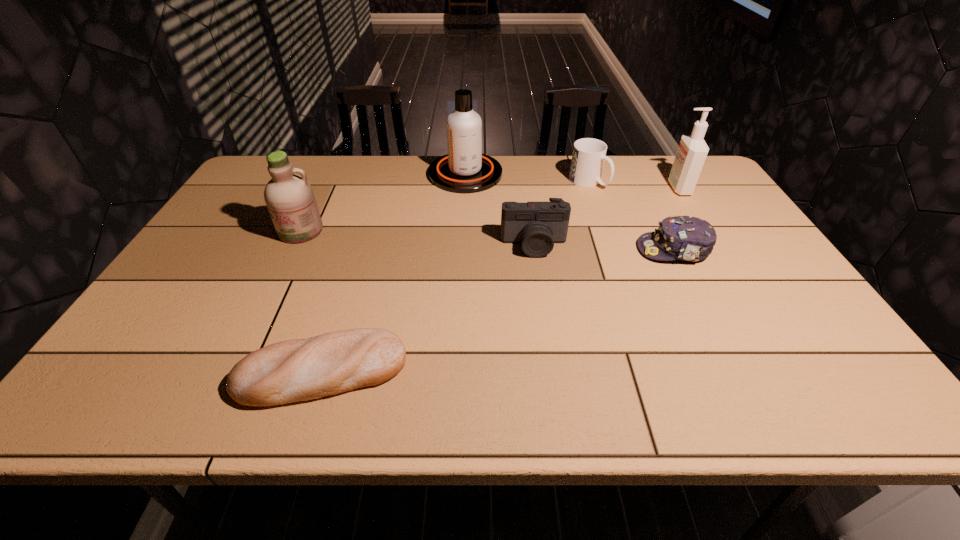
Locate an element on the screen. free space between the rightmost cleansing agent and the third object from right to left is located at coordinates (x=634, y=185).

Identify the location of empty space that is in between the second cleansing agent from left to right and the bread. The image size is (960, 540). (394, 273).

Where is `free spot between the leftmost cleansing agent and the nearest object`? This screenshot has width=960, height=540. free spot between the leftmost cleansing agent and the nearest object is located at coordinates (311, 301).

Where is `free space between the rightmost cleansing agent and the camera`? Image resolution: width=960 pixels, height=540 pixels. free space between the rightmost cleansing agent and the camera is located at coordinates (606, 217).

The width and height of the screenshot is (960, 540). I want to click on vacant point located between the nearest object and the leftmost cleansing agent, so click(x=311, y=301).

At what (x,y) coordinates should I click in order to perform the action: click on vacant area that lies between the rightmost cleansing agent and the camera. Please return your answer as a coordinate pair (x, y). Looking at the image, I should click on (606, 217).

Find the location of a particular element. Image resolution: width=960 pixels, height=540 pixels. vacant space in between the nearest object and the second cleansing agent from left to right is located at coordinates (394, 273).

Select which object is the fourth closest to the mug. Please provide its 2D coordinates. Your answer should be formatted as a tuple, i.e. [(x, y)], where the tuple contains the x and y coordinates of a point satisfying the conditions above.

[(464, 169)]

Identify the location of the third closest object to the third object from right to left. Image resolution: width=960 pixels, height=540 pixels. (537, 225).

Identify which cleansing agent is the nearest to the fifth object from left to right. Please provide its 2D coordinates. Your answer should be formatted as a tuple, i.e. [(x, y)], where the tuple contains the x and y coordinates of a point satisfying the conditions above.

[(692, 151)]